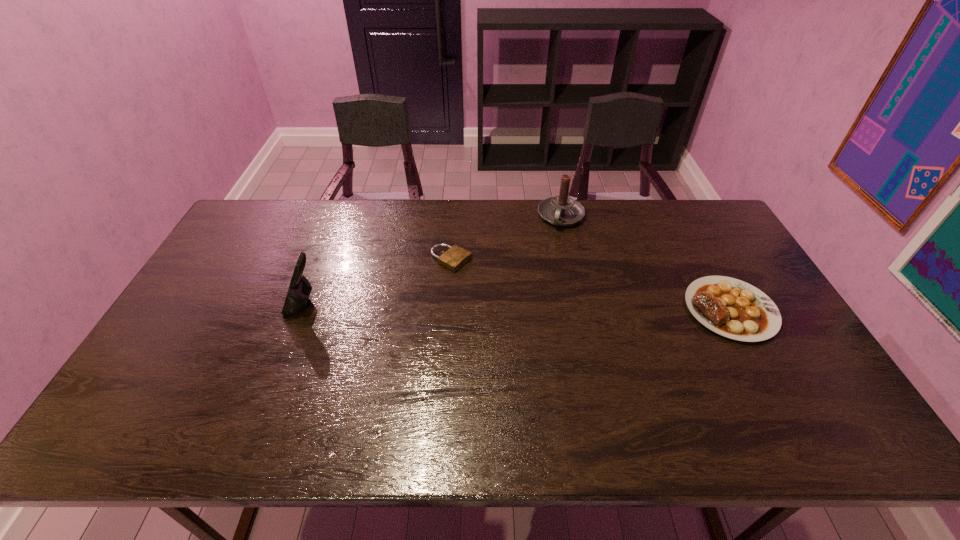
In order to click on free space located 0.160m on the left of the third tallest object in this screenshot , I will do `click(631, 309)`.

Locate an element on the screen. The image size is (960, 540). vacant region located 0.260m on the side of the farthest object with the handle loop is located at coordinates (538, 281).

Identify the location of vacant region located 0.170m on the side of the farthest object with the handle loop. (544, 263).

Locate an element on the screen. vacant space located 0.360m on the side of the farthest object with the handle loop is located at coordinates (529, 304).

Locate an element on the screen. The height and width of the screenshot is (540, 960). free point located 0.120m on the keyhole side of the padlock is located at coordinates (498, 284).

Where is `blank space located on the keyhole side of the padlock`? The height and width of the screenshot is (540, 960). blank space located on the keyhole side of the padlock is located at coordinates (x=480, y=274).

Find the location of `vacant region located on the keyhole side of the padlock`. vacant region located on the keyhole side of the padlock is located at coordinates (540, 306).

You are a GUI agent. You are given a task and a screenshot of the screen. Output one action in this format:
    pyautogui.click(x=<x>, y=<y>)
    Task: Click on the object at the far edge
    The width and height of the screenshot is (960, 540).
    Given the screenshot: What is the action you would take?
    pyautogui.click(x=561, y=210)

Where is `object present at the right edge`? object present at the right edge is located at coordinates point(732,308).

You are a GUI agent. You are given a task and a screenshot of the screen. Output one action in this format:
    pyautogui.click(x=<x>, y=<y>)
    Task: Click on the free space at the far edge of the desktop
    
    Given the screenshot: What is the action you would take?
    pyautogui.click(x=403, y=211)